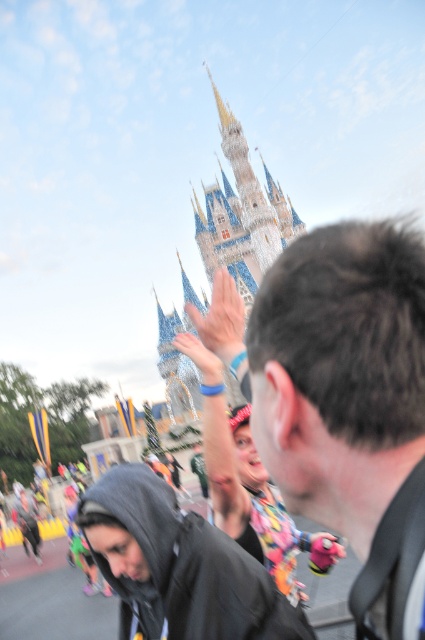
Question: Among these points, which one is nearest to the camera?

Choices:
 (A) (215, 221)
 (B) (229, 618)

Answer: (B)

Question: Does dark brown hair at center appear over white stone castle at center?

Choices:
 (A) no
 (B) yes

Answer: (A)

Question: Among these objects, which one is nearest to the camera?

Choices:
 (A) black matte jacket at lower left
 (B) white stone castle at center

Answer: (A)

Question: Which of the following is the farthest from the observer?

Choices:
 (A) (241, 182)
 (B) (266, 460)
 (C) (156, 632)

Answer: (A)

Question: Does dark brown hair at center have a larger size compared to black matte jacket at lower left?

Choices:
 (A) no
 (B) yes

Answer: (B)

Question: Does dark brown hair at center appear over white stone castle at center?

Choices:
 (A) yes
 (B) no

Answer: (B)